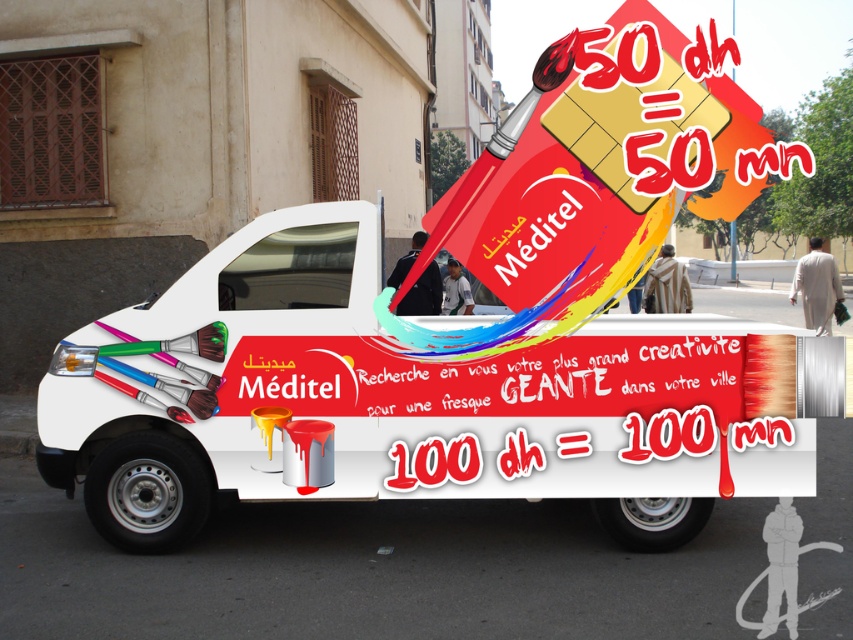
Does point (254, 278) come behind point (663, 374)?

Yes, point (254, 278) is behind point (663, 374).

The height and width of the screenshot is (640, 853). What do you see at coordinates (416, 401) in the screenshot?
I see `white matte truck at center` at bounding box center [416, 401].

Between point (764, 410) and point (669, 384), which one is positioned in front?

Point (764, 410) is more forward.

Identify the location of white matte truck at center. (416, 401).